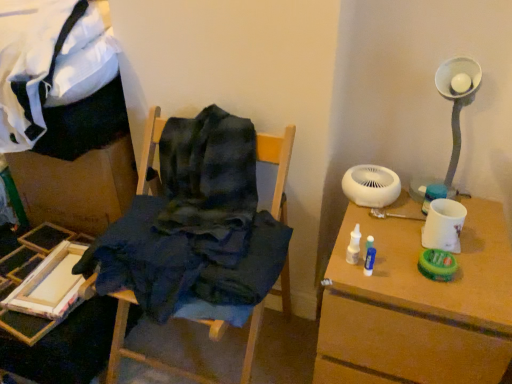
Question: Based on their positions, is dark blue fabric at center, the 1th furniture when ordered from right to left, located to the left or right of wooden paint tray at lower left, the first furniture in the left-to-right sequence?

Choices:
 (A) right
 (B) left

Answer: (A)

Question: Considering the positions of point (179, 370) and point (9, 329), is point (179, 370) closer or farther from the camera than point (9, 329)?

Choices:
 (A) farther
 (B) closer

Answer: (A)

Question: Which object is the farthest from the white matte mechanical fan at upper right?

Choices:
 (A) dark blue fabric at center, the 1th furniture when ordered from right to left
 (B) wooden paint tray at lower left, the first furniture in the left-to-right sequence
 (C) white matte table at right

Answer: (B)

Question: Estimate the real-world distances between objects in this image. Which object is farther from the dark blue fabric at center, the 1th furniture when ordered from right to left?

Choices:
 (A) white matte table at right
 (B) wooden paint tray at lower left, which ranks as the 2th furniture in right-to-left order
 (C) white matte mechanical fan at upper right

Answer: (A)